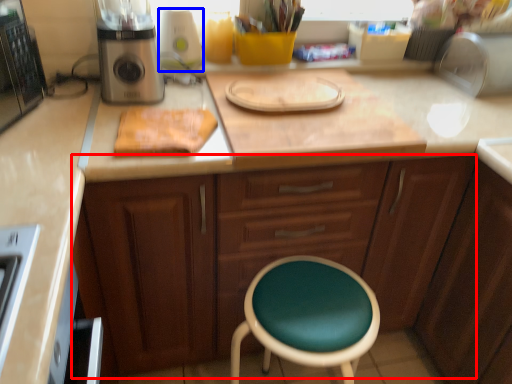
Question: Which object appears closest to the camera in this image, cabinetry (highlighted by a red box) or appliance (highlighted by a blue box)?

Choices:
 (A) cabinetry
 (B) appliance

Answer: (A)